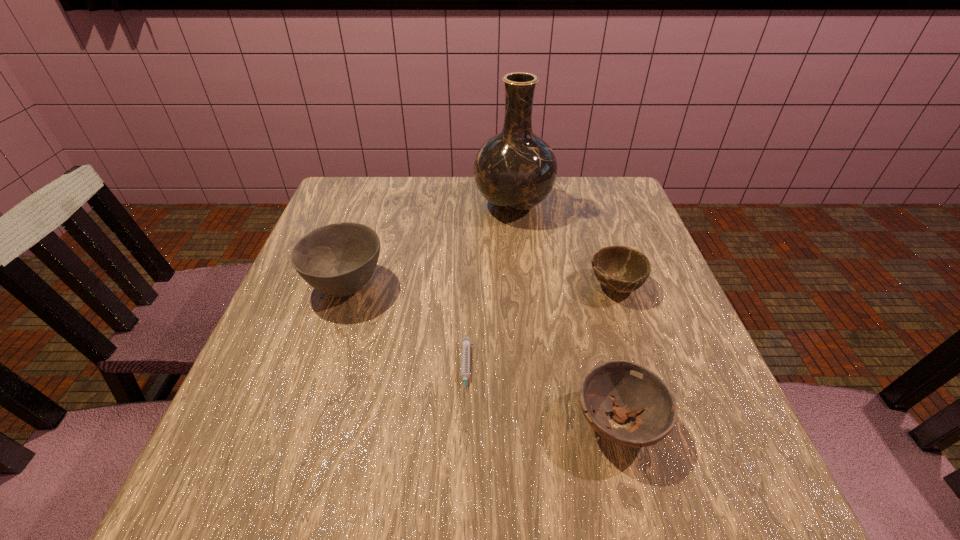
Identify the location of vacant space that satisfies the following two spatial constraints: 1. on the front side of the nearest bowl; 2. on the left side of the leftmost object. (300, 422).